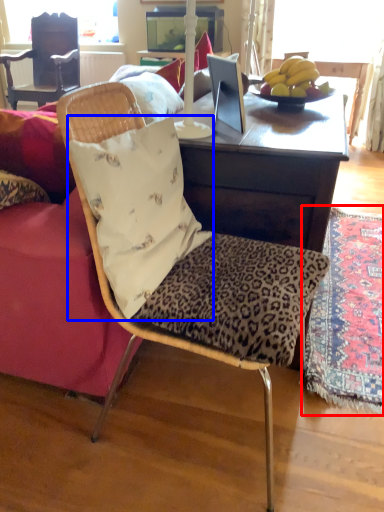
Question: Which of the following is the closest to the observer, mat (highlighted by a red box) or pillow (highlighted by a blue box)?

Choices:
 (A) mat
 (B) pillow

Answer: (B)